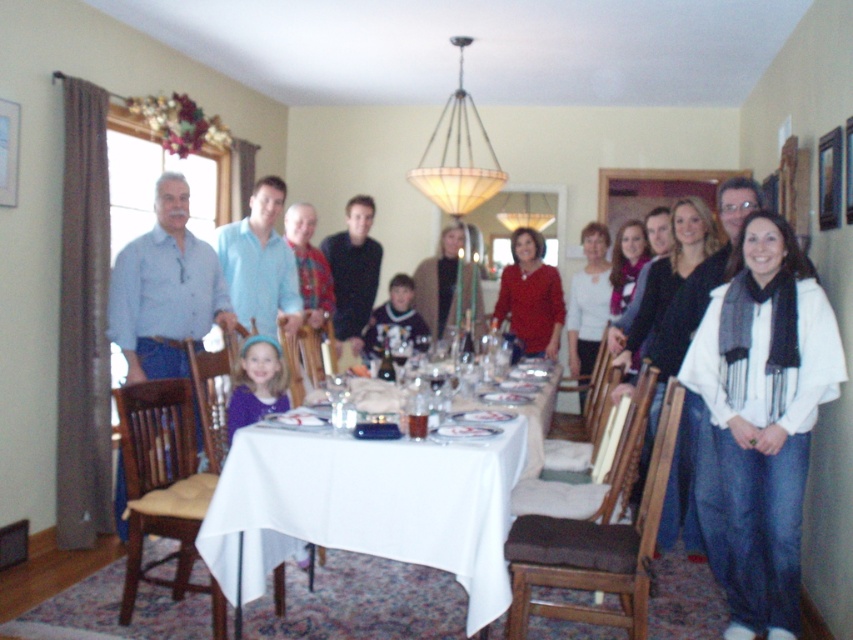
You are a guest at this dinner and need to choose a sweater to wear. Both the matte red sweater at center and the knitted sweater at center are available. Which one is bigger in size?

The matte red sweater at center is larger in size than the knitted sweater at center, so you should choose the matte red sweater at center.

You are standing at the entrance of the room looking towards the dining table. There is a white scarf at center. Where is the white scarf located in relation to the dining table?

The white scarf at center is located at the coordinates point (759, 420) relative to the dining table.

Consider the image. You are a server who needs to deliver a tray of drinks to the white cloth table at center. You are currently standing next to the white scarf at center. Can you reach the table without moving your feet?

A: The distance between the white scarf at center and the white cloth table at center is 1.06 meters. Since the server cannot reach 1.06 meters without moving their feet, they would need to take a step forward to deliver the tray.